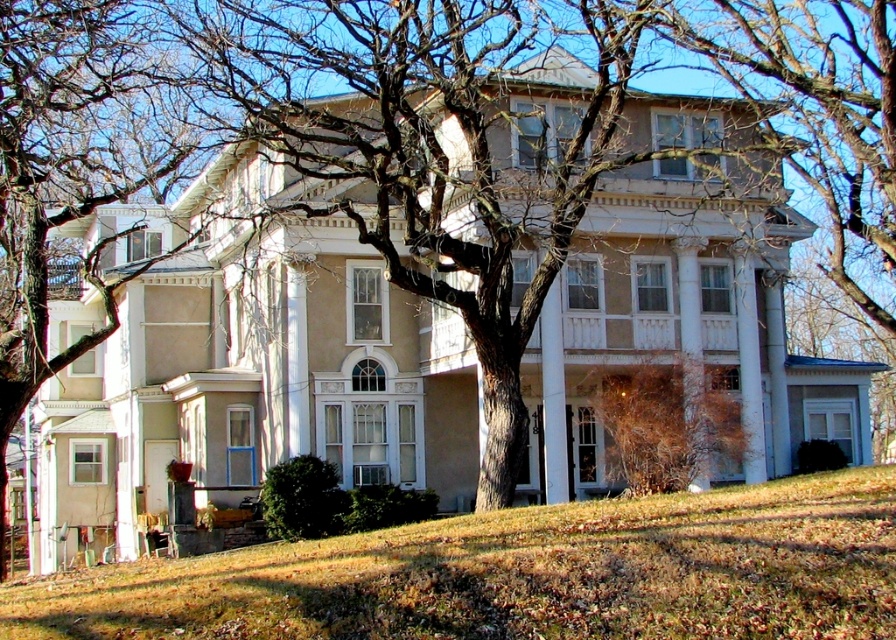
Where is `brown bark tree at center`? This screenshot has height=640, width=896. brown bark tree at center is located at coordinates (444, 150).

Is brown bark tree at center bigger than brown grass at lower center?

Yes, brown bark tree at center is bigger than brown grass at lower center.

Does point (565, 161) come farther from viewer compared to point (296, 609)?

Yes, it is.

The width and height of the screenshot is (896, 640). What are the coordinates of `brown bark tree at center` in the screenshot? It's located at (444, 150).

Is brown bark tree at left positioned before brown dry bush at lower right?

No, brown bark tree at left is behind brown dry bush at lower right.

Does brown bark tree at left have a lesser height compared to brown dry bush at lower right?

Incorrect, brown bark tree at left's height does not fall short of brown dry bush at lower right's.

Does point (5, 61) come behind point (658, 364)?

Yes, point (5, 61) is farther from viewer.

Image resolution: width=896 pixels, height=640 pixels. In order to click on brown bark tree at left in this screenshot , I will do `click(72, 166)`.

Locate an element on the screen. This screenshot has width=896, height=640. brown grass at lower center is located at coordinates (522, 573).

Can you confirm if brown grass at lower center is smaller than brown bark tree at left?

Yes, brown grass at lower center is smaller than brown bark tree at left.

Between point (576, 508) and point (154, 108), which one is positioned behind?

Positioned behind is point (154, 108).

The image size is (896, 640). Find the location of `brown grass at lower center`. brown grass at lower center is located at coordinates (522, 573).